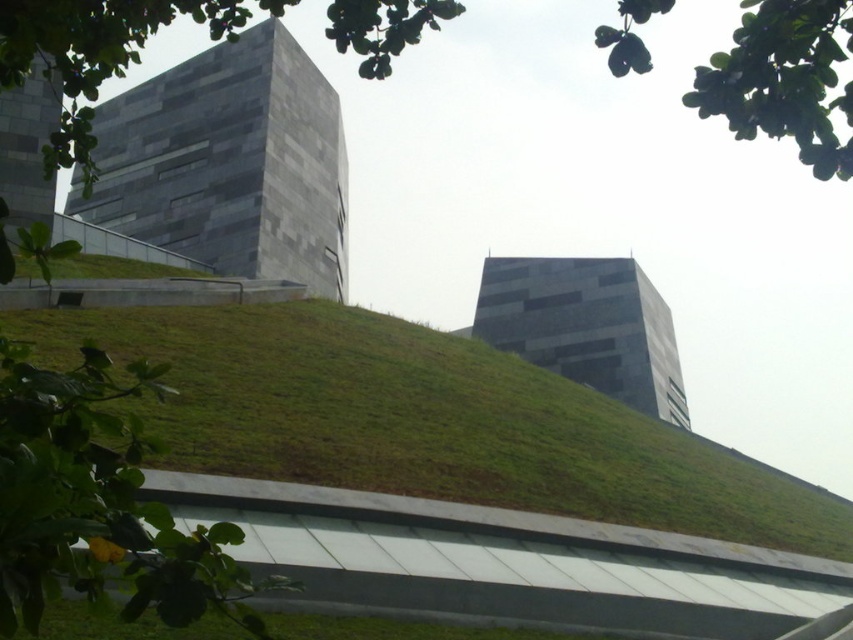
You are a landscape architect planning to install a walkway between the green grass at center and the gray stone building at upper left. Which area has a greater horizontal space to accommodate the walkway?

The green grass at center has a greater horizontal space than the gray stone building at upper left because its width surpasses the building.

You are standing at the point marked as point (426, 420) in the image. Looking around, you see the green grass at center and the two angular buildings. Which direction should you walk to reach the building on the left that is at the top of the hill?

The green grass at center is located at point (426, 420). Since the building on the left is at the top of the hill, you should walk towards the direction of the building on the left, which is uphill from your current position at the green grass at center.

You are a landscape architect designing a garden between the green grass at center and the gray stone building at upper left. Considering their height, which one should you place a tall decorative tree next to to ensure it doesn not block the view of the shorter one?

The green grass at center is shorter than the gray stone building at upper left. Therefore, you should place the tall decorative tree next to the green grass at center to avoid blocking the view of the shorter grass.